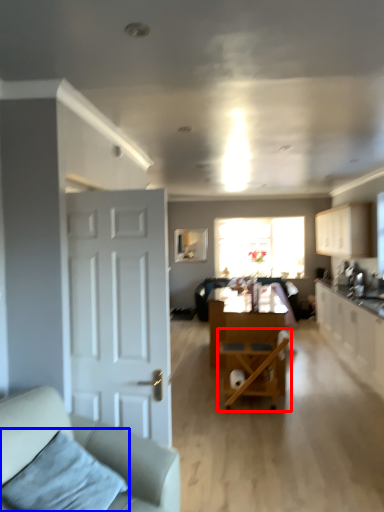
Question: Which object appears farthest to the camera in this image, chair (highlighted by a red box) or pillow (highlighted by a blue box)?

Choices:
 (A) chair
 (B) pillow

Answer: (A)